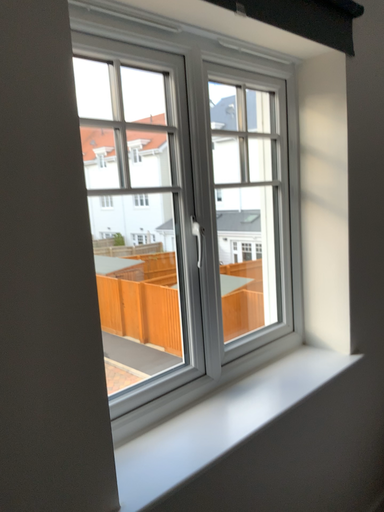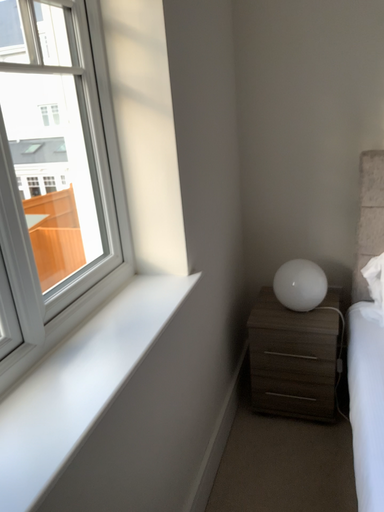
Question: Which way did the camera rotate in the video?

Choices:
 (A) rotated right
 (B) rotated left

Answer: (A)